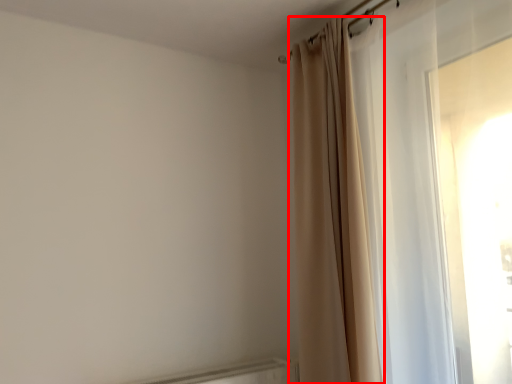
Question: Considering the relative positions of curtain (annotated by the red box) and curtain in the image provided, where is curtain (annotated by the red box) located with respect to the staircase?

Choices:
 (A) right
 (B) left

Answer: (B)